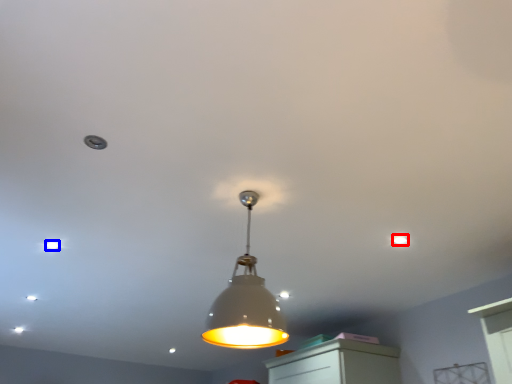
Question: Which object appears farthest to the camera in this image, dot (highlighted by a red box) or dot (highlighted by a blue box)?

Choices:
 (A) dot
 (B) dot

Answer: (B)